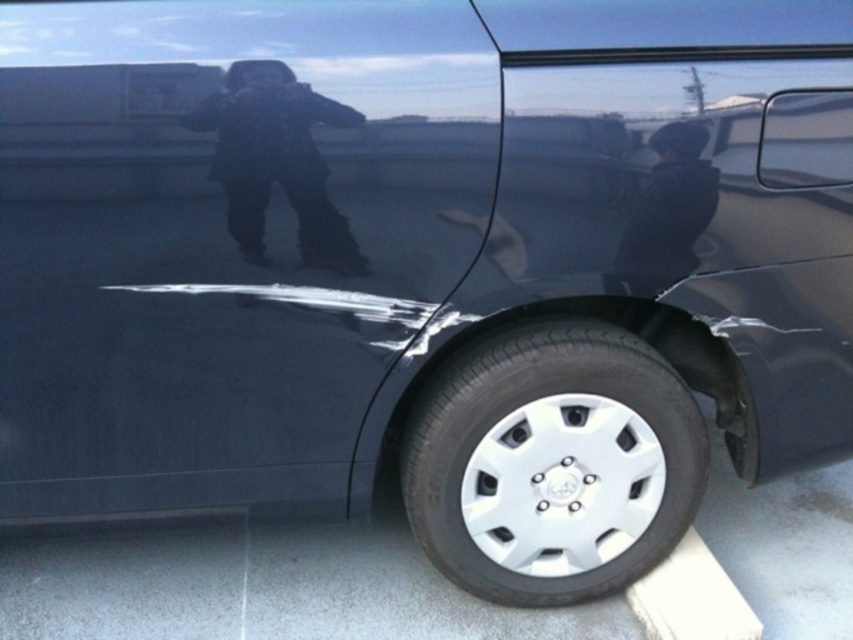
Does point (340, 244) come in front of point (648, 252)?

Yes, it is in front of point (648, 252).

Looking at this image, who is positioned more to the left, black textured coat at upper center or dark gray fabric jacket at lower right?

Positioned to the left is black textured coat at upper center.

Which is in front, point (241, 68) or point (621, 241)?

Point (241, 68) is in front.

Locate an element on the screen. The width and height of the screenshot is (853, 640). black textured coat at upper center is located at coordinates (276, 161).

Which is below, silver metallic wheel at lower center or dark gray fabric jacket at lower right?

Positioned lower is silver metallic wheel at lower center.

Is point (596, 333) behind point (624, 243)?

That is True.

Who is more forward, (492, 499) or (693, 163)?

Point (693, 163) is more forward.

Find the location of `silver metallic wheel at lower center`. silver metallic wheel at lower center is located at coordinates (550, 461).

Between silver metallic wheel at lower center and black textured coat at upper center, which one is positioned higher?

Positioned higher is black textured coat at upper center.

Is silver metallic wheel at lower center above black textured coat at upper center?

Actually, silver metallic wheel at lower center is below black textured coat at upper center.

Is point (596, 588) positioned behind point (294, 104)?

Yes, it is.

Locate an element on the screen. silver metallic wheel at lower center is located at coordinates (550, 461).